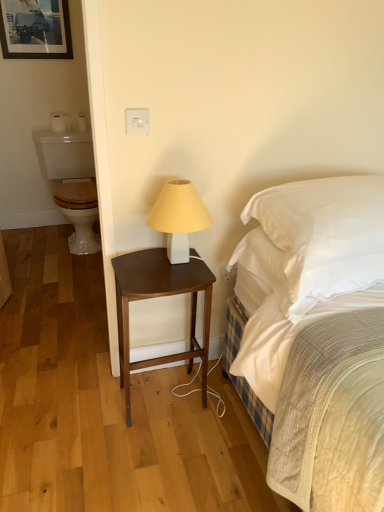
This screenshot has width=384, height=512. In order to click on free spot in front of white matte table lamp at center in this screenshot , I will do `click(168, 281)`.